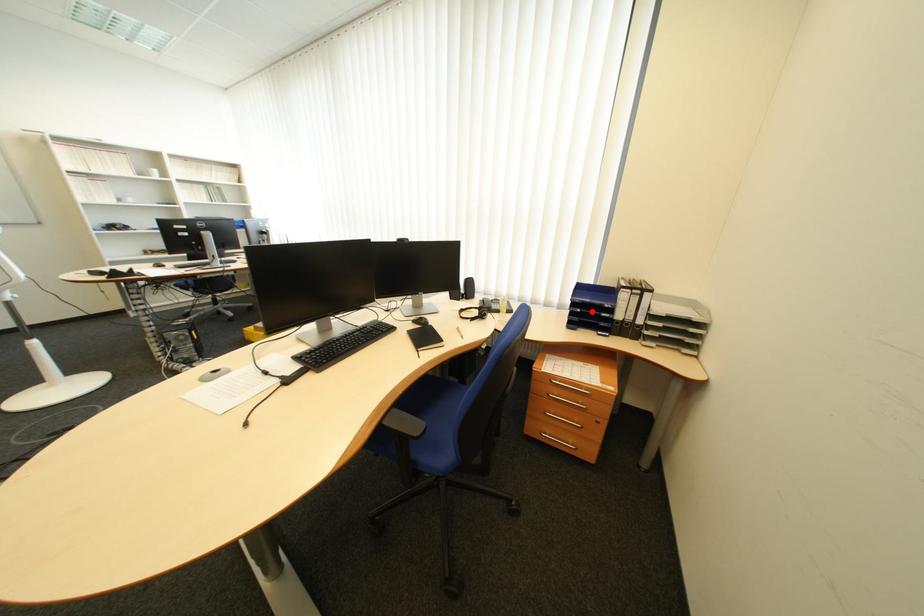
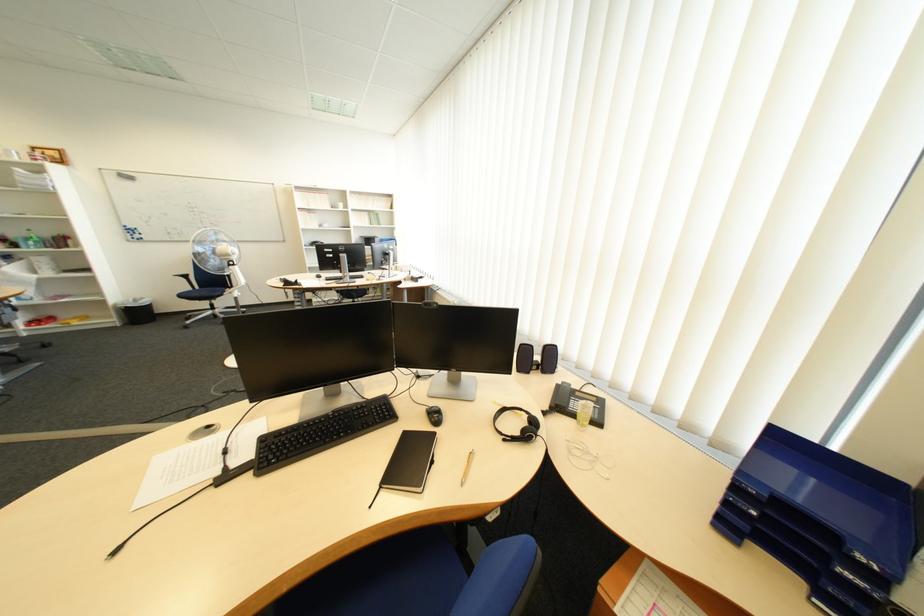
Question: I am providing you with two images of the same scene from different viewpoints. Given a red point in image1, look at the same physical point in image2. Is it:

Choices:
 (A) Closer to the viewpoint
 (B) Farther from the viewpoint

Answer: (B)